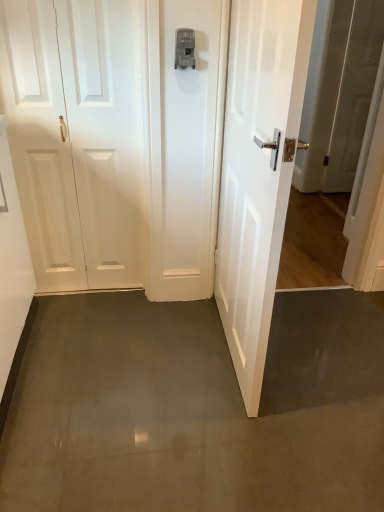
Question: From the image's perspective, is white glossy door at right, which appears as the first door when viewed from the right, positioned above or below matte gray latch at center?

Choices:
 (A) above
 (B) below

Answer: (B)

Question: Visually, is white glossy door at right, which appears as the first door when viewed from the right, positioned to the left or to the right of matte gray latch at center?

Choices:
 (A) left
 (B) right

Answer: (B)

Question: Considering the real-world distances, which object is closest to the matte gray latch at center?

Choices:
 (A) white glossy door at left, the 1th door positioned from the left
 (B) white glossy door at right, the 2th door in the left-to-right sequence

Answer: (A)

Question: Estimate the real-world distances between objects in this image. Which object is farther from the matte gray latch at center?

Choices:
 (A) white glossy door at right, the 2th door in the left-to-right sequence
 (B) white glossy door at left, the second door from the right

Answer: (A)